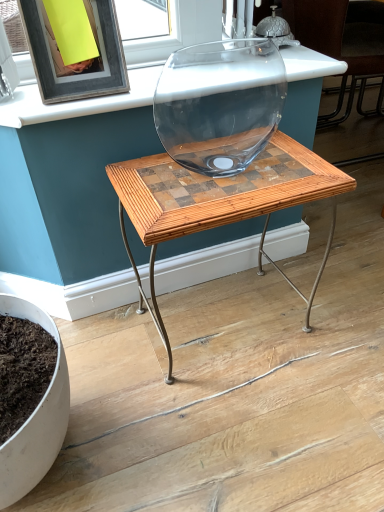
The height and width of the screenshot is (512, 384). Identify the location of transparent glass vase at center. (339, 46).

At what (x,y) coordinates should I click in order to perform the action: click on transparent glass bowl at upper center. Please return your answer as a coordinate pair (x, y). The image size is (384, 512). Looking at the image, I should click on (78, 101).

This screenshot has height=512, width=384. What are the coordinates of `matte black frame at upper left` in the screenshot? It's located at (69, 66).

The image size is (384, 512). I want to click on transparent glass vase at center, so click(x=339, y=46).

Who is smaller, wooden mosaic table at center or transparent glass bowl at upper center?

transparent glass bowl at upper center is smaller.

Between point (268, 168) and point (88, 103), which one is positioned in front?

The point (88, 103) is more forward.

Is wooden mosaic table at center looking in the opposite direction of transparent glass bowl at upper center?

No.

Is transparent glass bowl at upper center located outside transparent glass vase at center?

Yes, transparent glass bowl at upper center is outside of transparent glass vase at center.

Find the location of a particular element. chair that appears above the transparent glass bowl at upper center (from the image's perspective) is located at coordinates (339, 46).

Is transparent glass bowl at upper center bigger than transparent glass vase at center?

Actually, transparent glass bowl at upper center might be smaller than transparent glass vase at center.

Is transparent glass bowl at upper center at the left side of transparent glass vase at center?

Correct, you'll find transparent glass bowl at upper center to the left of transparent glass vase at center.

From a real-world perspective, is transparent glass vase at center on transparent glass bowl at upper center?

Actually, transparent glass vase at center is physically below transparent glass bowl at upper center in the real world.

Which object is positioned more to the left, transparent glass vase at center or transparent glass bowl at upper center?

transparent glass bowl at upper center.

In the scene shown: Can you confirm if transparent glass vase at center is shorter than transparent glass bowl at upper center?

No.

What's the angular difference between transparent glass vase at center and transparent glass bowl at upper center's facing directions?

90 degrees separate the facing orientations of transparent glass vase at center and transparent glass bowl at upper center.

Is transparent glass bowl at upper center wider than matte black frame at upper left?

Correct, the width of transparent glass bowl at upper center exceeds that of matte black frame at upper left.

How different are the orientations of transparent glass bowl at upper center and matte black frame at upper left in degrees?

They differ by 0.476 degrees in their facing directions.

Does transparent glass bowl at upper center have a greater height compared to matte black frame at upper left?

Incorrect, the height of transparent glass bowl at upper center is not larger of that of matte black frame at upper left.

Is transparent glass bowl at upper center to the left or to the right of matte black frame at upper left in the image?

transparent glass bowl at upper center is to the right of matte black frame at upper left.

Considering the positions of objects transparent glass vase at center and matte black frame at upper left in the image provided, who is more to the left, transparent glass vase at center or matte black frame at upper left?

From the viewer's perspective, matte black frame at upper left appears more on the left side.

Is the depth of transparent glass vase at center greater than that of matte black frame at upper left?

Yes, it is behind matte black frame at upper left.

Could you tell me if transparent glass vase at center is turned towards matte black frame at upper left?

No, transparent glass vase at center does not turn towards matte black frame at upper left.

From a real-world perspective, is matte black frame at upper left on transparent glass vase at center?

Yes, from a real-world perspective, matte black frame at upper left is above transparent glass vase at center.

Does matte black frame at upper left have a larger size compared to transparent glass vase at center?

No.

Is matte black frame at upper left not close to transparent glass vase at center?

No, matte black frame at upper left is in close proximity to transparent glass vase at center.

Can we say matte black frame at upper left lies outside transparent glass vase at center?

That's correct, matte black frame at upper left is outside of transparent glass vase at center.

Can you confirm if wooden mosaic table at center is wider than transparent glass vase at center?

No, wooden mosaic table at center is not wider than transparent glass vase at center.

Is point (278, 192) positioned before point (350, 63)?

Yes, it is in front of point (350, 63).

From the image's perspective, is wooden mosaic table at center above transparent glass vase at center?

No, from the image's perspective, wooden mosaic table at center is not above transparent glass vase at center.

Image resolution: width=384 pixels, height=512 pixels. Identify the location of table that is on the right side of transparent glass bowl at upper center. (220, 203).

Locate an element on the screen. counter top above the transparent glass vase at center (from a real-world perspective) is located at coordinates (78, 101).

Based on their spatial positions, is transparent glass vase at center or wooden mosaic table at center closer to transparent glass bowl at upper center?

Based on the image, wooden mosaic table at center appears to be nearer to transparent glass bowl at upper center.

Looking at this image, which object lies nearer to the anchor point wooden mosaic table at center, matte black frame at upper left or transparent glass bowl at upper center?

The object closer to wooden mosaic table at center is transparent glass bowl at upper center.

When comparing their distances from transparent glass vase at center, does wooden mosaic table at center or matte black frame at upper left seem further?

Based on the image, matte black frame at upper left appears to be further to transparent glass vase at center.

From the image, which object appears to be farther from matte black frame at upper left, transparent glass bowl at upper center or transparent glass vase at center?

transparent glass vase at center is further to matte black frame at upper left.

Looking at the image, which one is located further to transparent glass vase at center, transparent glass bowl at upper center or matte black frame at upper left?

matte black frame at upper left lies further to transparent glass vase at center than the other object.

Looking at the image, which one is located further to transparent glass bowl at upper center, transparent glass vase at center or matte black frame at upper left?

Based on the image, transparent glass vase at center appears to be further to transparent glass bowl at upper center.

Estimate the real-world distances between objects in this image. Which object is closer to matte black frame at upper left, transparent glass bowl at upper center or wooden mosaic table at center?

The object closer to matte black frame at upper left is transparent glass bowl at upper center.

Based on their spatial positions, is transparent glass vase at center or wooden mosaic table at center closer to matte black frame at upper left?

The object closer to matte black frame at upper left is wooden mosaic table at center.

The image size is (384, 512). Find the location of `table between matte black frame at upper left and transparent glass vase at center`. table between matte black frame at upper left and transparent glass vase at center is located at coordinates (220, 203).

The image size is (384, 512). Identify the location of counter top between transparent glass vase at center and wooden mosaic table at center in the up-down direction. (78, 101).

You are a GUI agent. You are given a task and a screenshot of the screen. Output one action in this format:
    pyautogui.click(x=<x>, y=<y>)
    Task: Click on the counter top between matte black frame at upper left and wooden mosaic table at center in the up-down direction
    This screenshot has width=384, height=512.
    Given the screenshot: What is the action you would take?
    pyautogui.click(x=78, y=101)

Locate an element on the screen. counter top between matte black frame at upper left and transparent glass vase at center from left to right is located at coordinates (78, 101).